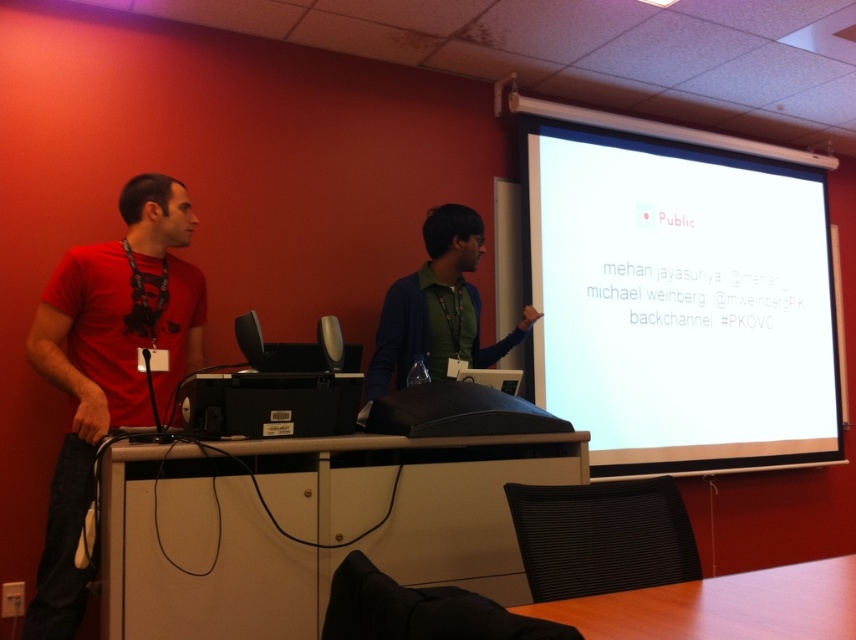
You are an attendee at the presentation. You notice the white glossy projection screen at upper right and the green matte shirt at center. Which object is closer to the front of the room?

The green matte shirt at center is closer to the front of the room because the white glossy projection screen at upper right is positioned over it, indicating it is further back.

You are setting up for a presentation and need to place both the white glossy table at lower center and the black matte projector at center on the desk. Given their sizes, which one should you place first to ensure there is enough space for both?

You should place the white glossy table at lower center first since it is larger in size than the black matte projector at center, ensuring there is enough space left for the smaller projector.